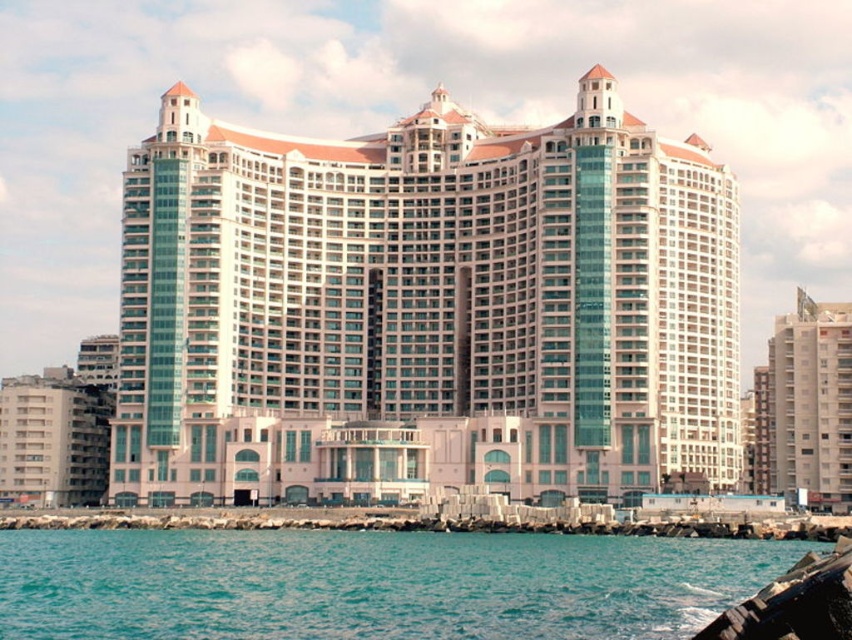
Question: Which of the following is the farthest from the observer?

Choices:
 (A) (783, 326)
 (B) (55, 577)
 (C) (43, 440)

Answer: (C)

Question: Is teal water at lower left wider than beige concrete building at right?

Choices:
 (A) yes
 (B) no

Answer: (A)

Question: Where is white glass building at center located in relation to beige concrete building at lower left in the image?

Choices:
 (A) right
 (B) left

Answer: (A)

Question: Among these points, which one is nearest to the camera?

Choices:
 (A) (95, 522)
 (B) (458, 618)
 (C) (498, 468)

Answer: (B)

Question: Which point appears farthest from the camera in this image?

Choices:
 (A) (453, 518)
 (B) (787, 438)

Answer: (B)

Question: In this image, where is white glass building at center located relative to teal water at lower left?

Choices:
 (A) left
 (B) right

Answer: (B)